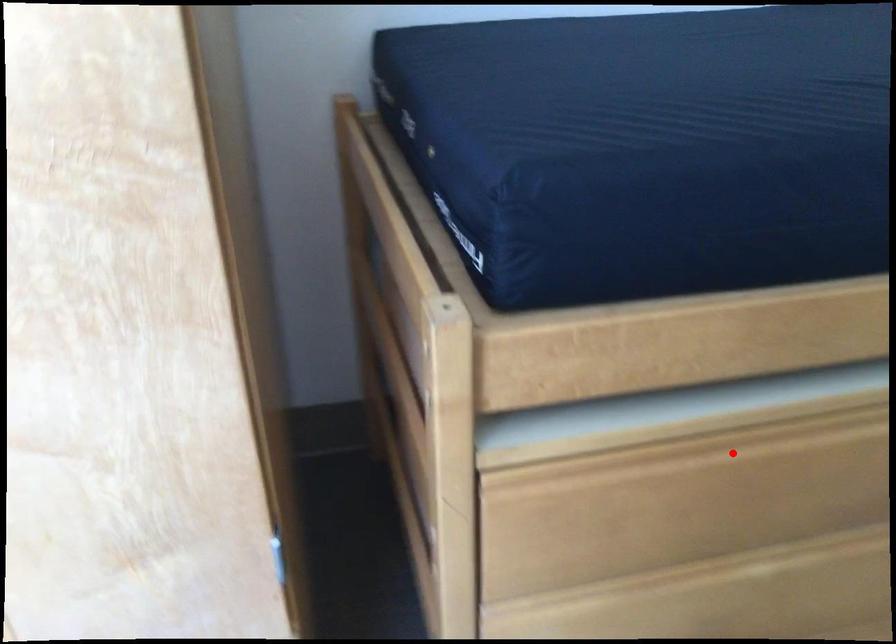
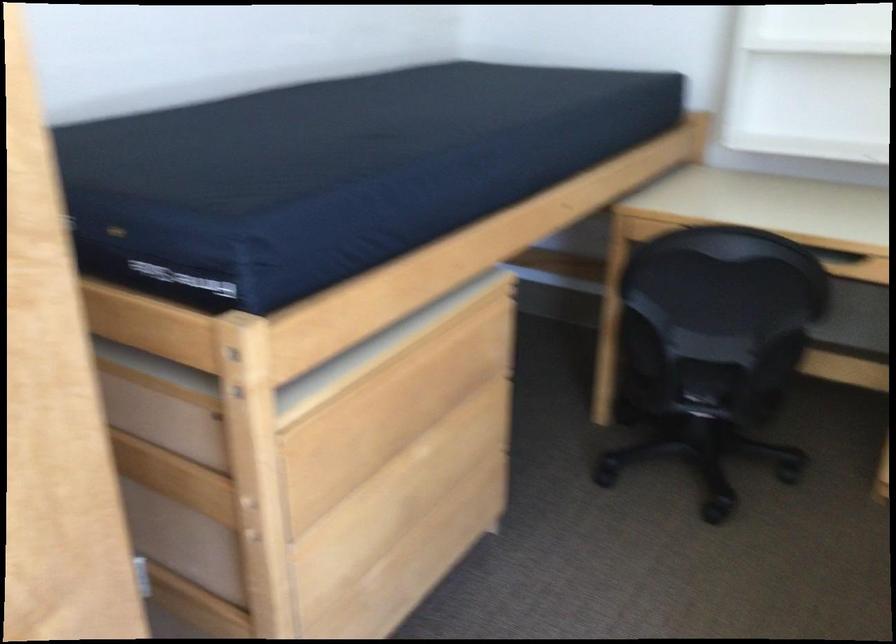
In the second image, find the point that corresponds to the highlighted location in the first image.

(403, 379)